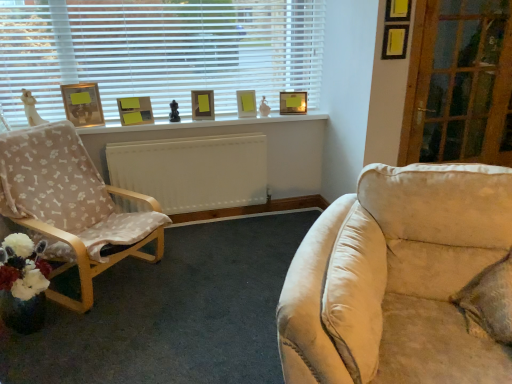
Question: From the image's perspective, is matte wooden picture frame at upper center, the 5th picture frame positioned from the left, positioned above or below white plastic blinds at upper left?

Choices:
 (A) below
 (B) above

Answer: (A)

Question: From a real-world perspective, is matte wooden picture frame at upper center, the 5th picture frame positioned from the left, above or below white plastic blinds at upper left?

Choices:
 (A) below
 (B) above

Answer: (A)

Question: Estimate the real-world distances between objects in this image. Which object is closer to the white painted wood at upper center?

Choices:
 (A) gold metallic picture frame at upper left, placed as the 1th picture frame when sorted from left to right
 (B) beige fabric chair at left
 (C) transparent wooden door at right
 (D) matte wooden picture frame at center, which ranks as the 2th picture frame in left-to-right order
 (E) white plastic blinds at upper left

Answer: (D)

Question: Estimate the real-world distances between objects in this image. Which object is closer to the beige fabric chair at left?

Choices:
 (A) matte yellow picture frame at upper center, which is the second picture frame in right-to-left order
 (B) matte wooden picture frame at center, the 4th picture frame positioned from the right
 (C) white painted wood at upper center
 (D) matte wooden picture frame at upper center, positioned as the 1th picture frame in right-to-left order
 (E) green textured pillow at lower right

Answer: (C)